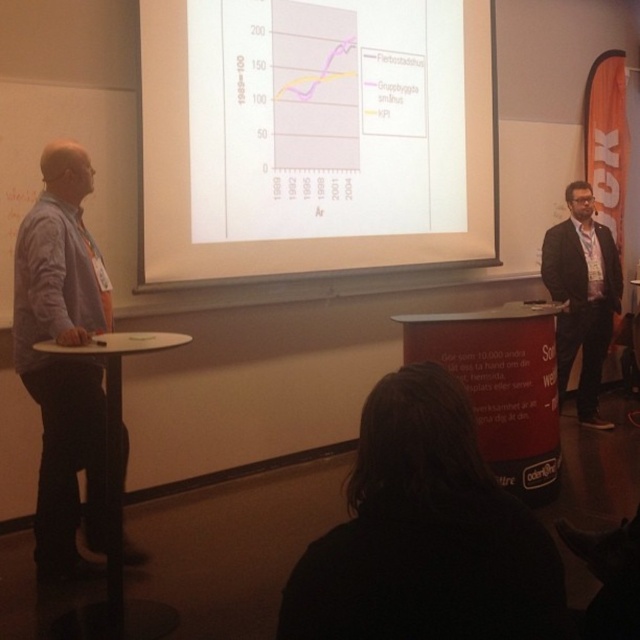
Is white paper at center closer to the viewer compared to black fabric at lower center?

No, it is behind black fabric at lower center.

Identify the location of white paper at center. This screenshot has width=640, height=640. (316, 136).

The width and height of the screenshot is (640, 640). Identify the location of white paper at center. (316, 136).

The width and height of the screenshot is (640, 640). In order to click on white paper at center in this screenshot , I will do `click(316, 136)`.

Which of these two, blue shirt at left or black suit at right, stands shorter?

black suit at right is shorter.

Consider the image. Is blue shirt at left positioned behind black suit at right?

No, it is not.

Is point (99, 365) positioned before point (566, 280)?

Yes, it is in front of point (566, 280).

Image resolution: width=640 pixels, height=640 pixels. I want to click on blue shirt at left, so click(x=61, y=358).

Does black fabric at lower center have a greater width compared to blue shirt at left?

In fact, black fabric at lower center might be narrower than blue shirt at left.

Based on the photo, does black fabric at lower center appear over blue shirt at left?

No.

Locate an element on the screen. The image size is (640, 640). black fabric at lower center is located at coordinates (426, 534).

Locate an element on the screen. black fabric at lower center is located at coordinates (426, 534).